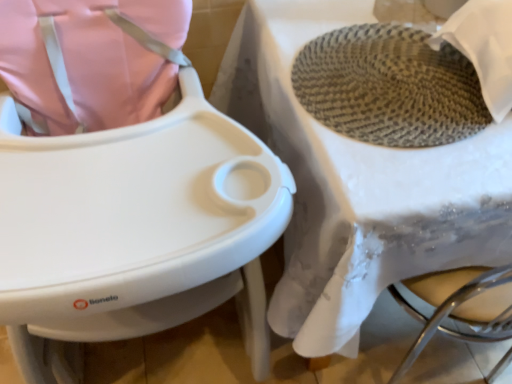
This screenshot has height=384, width=512. Find the location of `empty space that is ontop of white textured table at center (from a real-world perspective)`. empty space that is ontop of white textured table at center (from a real-world perspective) is located at coordinates (402, 92).